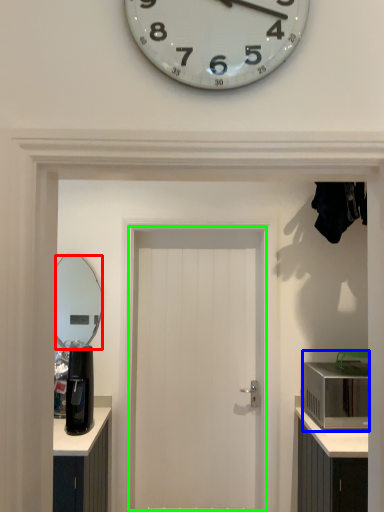
Question: Considering the real-world distances, which object is closest to mirror (highlighted by a red box)? appliance (highlighted by a blue box) or door (highlighted by a green box).

Choices:
 (A) appliance
 (B) door

Answer: (B)